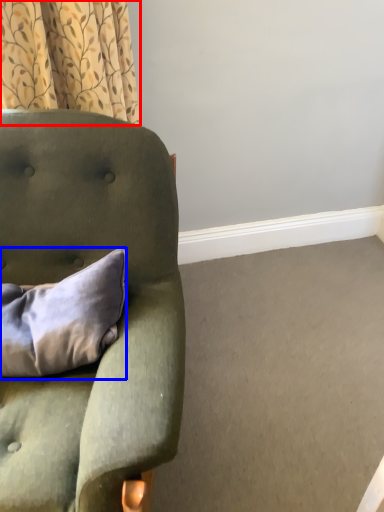
Question: Which point is closer to the camera, curtain (highlighted by a red box) or pillow (highlighted by a blue box)?

Choices:
 (A) curtain
 (B) pillow

Answer: (B)